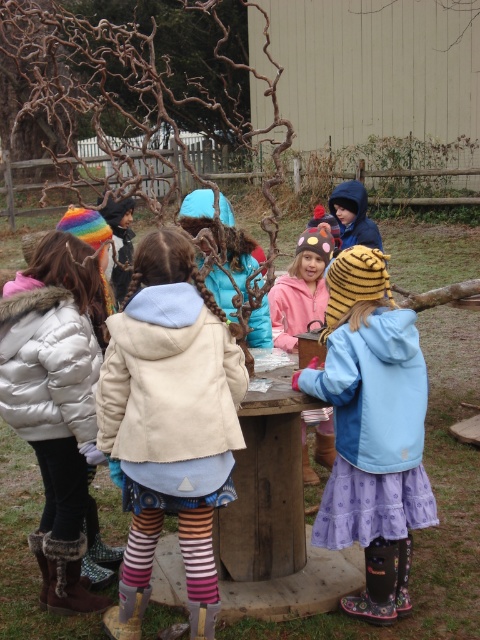
You are a photographer trying to capture both the blue fleece jacket at center and the white puffy jacket at left in a single shot. Based on their positions, which jacket should you focus on first to ensure both are in frame?

The blue fleece jacket at center is below the white puffy jacket at left, so you should focus on the white puffy jacket at left first to ensure both are in frame.

In the scene shown: You are a photographer standing at the center of the image. You want to take a photo of the beige wool coat at center. Where should you position your camera to capture it clearly?

The beige wool coat at center is located at point 0.662 on the x axis and 0.354 on the y axis, so you should position your camera to aim towards those coordinates to capture it clearly.

You are a tailor observing the children at the wooden table. You need to determine which jacket has a greater width to recommend the right size for a customer. Which one is wider between the blue fleece jacket at center and the pink fleece jacket at center?

The blue fleece jacket at center is wider than the pink fleece jacket at center according to the description.